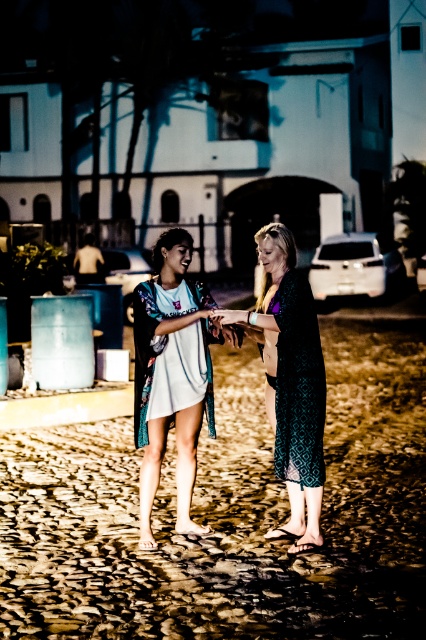
Is smooth sand at center to the right of matte black hair at center from the viewer's perspective?

Indeed, smooth sand at center is positioned on the right side of matte black hair at center.

Between smooth sand at center and matte black hair at center, which one has less height?

matte black hair at center

Identify the location of smooth sand at center. (229, 515).

Which is more to the right, dark green patterned dress at center or matte black phone at center?

From the viewer's perspective, dark green patterned dress at center appears more on the right side.

Is dark green patterned dress at center smaller than matte black phone at center?

Incorrect, dark green patterned dress at center is not smaller in size than matte black phone at center.

Is point (305, 428) positioned in front of point (227, 310)?

Yes.

Find the location of a particular element. Image resolution: width=426 pixels, height=640 pixels. dark green patterned dress at center is located at coordinates (x=298, y=384).

Who is positioned more to the left, white matte dress at center or matte black phone at center?

From the viewer's perspective, white matte dress at center appears more on the left side.

Does point (192, 280) come farther from viewer compared to point (222, 320)?

Yes.

Between point (141, 330) and point (235, 321), which one is positioned in front?

Point (235, 321)

This screenshot has width=426, height=640. I want to click on white matte dress at center, so [154, 342].